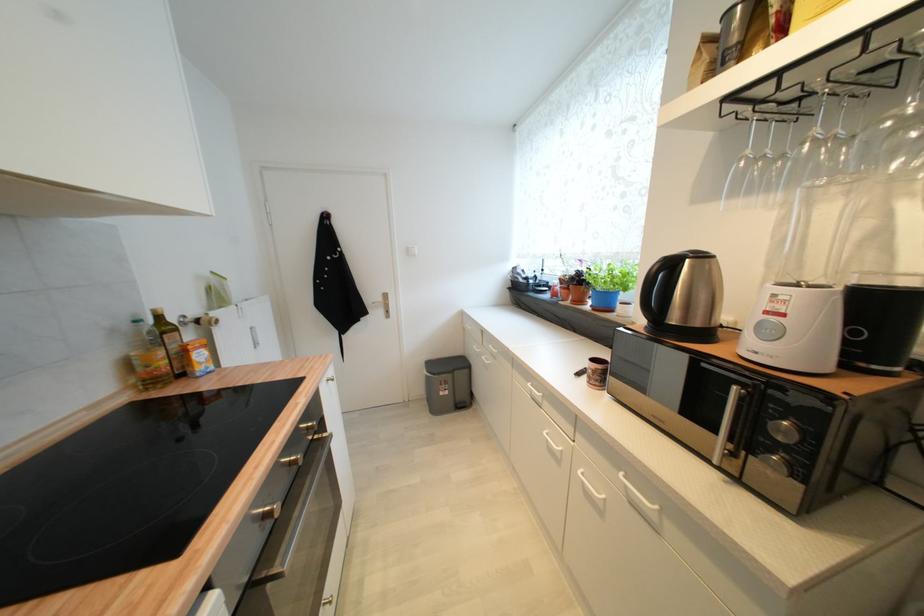
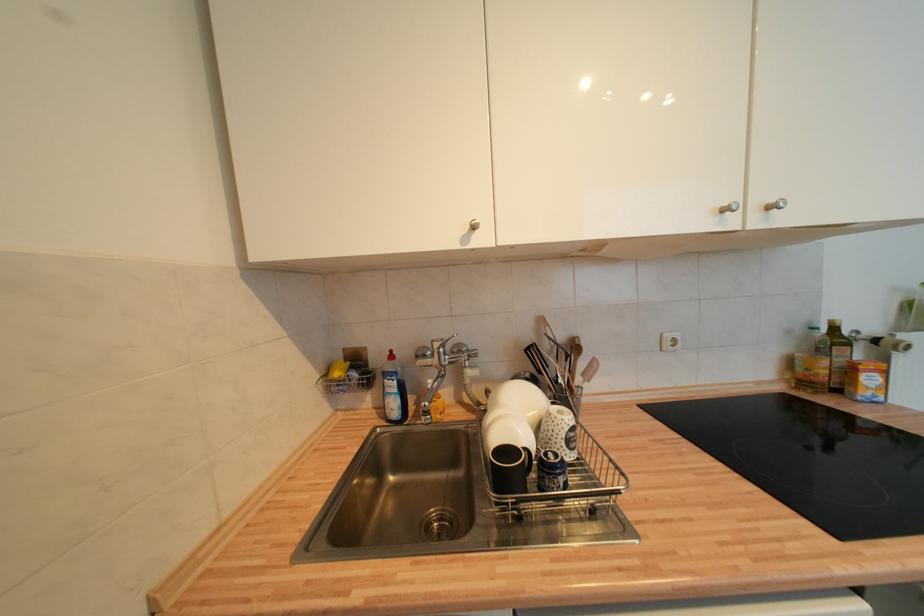
Find the pixel in the second image that matches pixel 141 323 in the first image.

(819, 331)